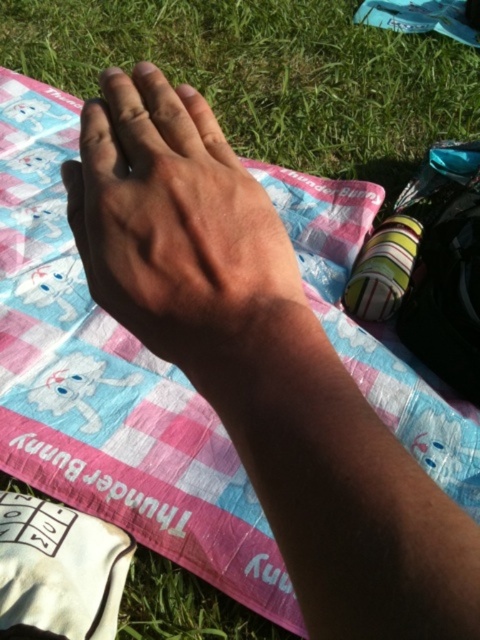
Question: Observing the image, what is the correct spatial positioning of green grass at upper center in reference to dry skin hand at center?

Choices:
 (A) right
 (B) left

Answer: (A)

Question: Which point is closer to the camera?

Choices:
 (A) (85, 109)
 (B) (238, 44)

Answer: (A)

Question: Is the position of green grass at upper center more distant than that of dry skin hand at center?

Choices:
 (A) yes
 (B) no

Answer: (A)

Question: Is green grass at upper center bigger than dry skin hand at center?

Choices:
 (A) yes
 (B) no

Answer: (A)